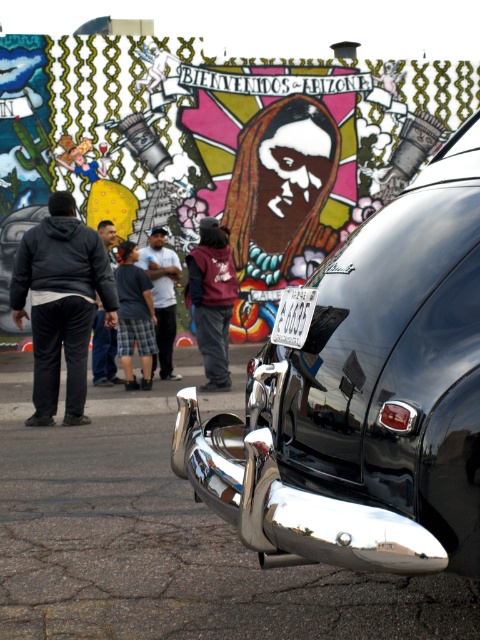
Question: Does matte black car at lower right appear on the right side of white plastic license plate at center?

Choices:
 (A) no
 (B) yes

Answer: (B)

Question: Which point is closer to the camera?

Choices:
 (A) polished chrome bumper at center
 (B) black cotton pants at left
 (C) white plastic license plate at center
 (D) matte black car at lower right

Answer: (A)

Question: Estimate the real-world distances between objects in this image. Which object is farther from the black cotton pants at left?

Choices:
 (A) matte black car at lower right
 (B) white cotton shirt at center

Answer: (A)

Question: Is maroon fleece jacket at center above yellow hard hat at center?

Choices:
 (A) yes
 (B) no

Answer: (A)

Question: Which point is closer to the camera?

Choices:
 (A) (230, 512)
 (B) (158, 234)
 (C) (105, 348)

Answer: (A)

Question: Does polished chrome bumper at center have a smaller size compared to black cotton pants at left?

Choices:
 (A) yes
 (B) no

Answer: (B)